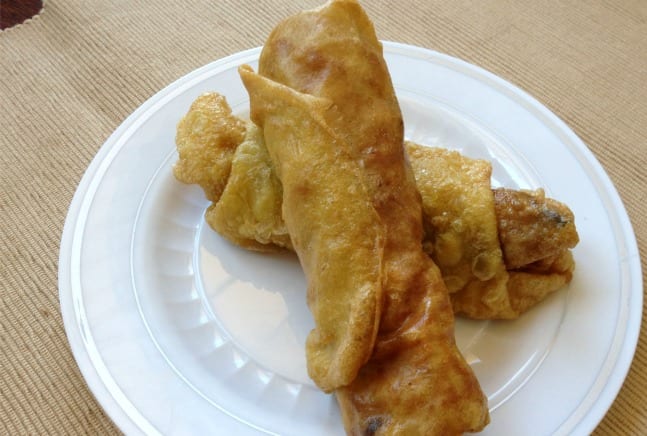
You are a GUI agent. You are given a task and a screenshot of the screen. Output one action in this format:
    pyautogui.click(x=<x>, y=<y>)
    Task: Click on the wood surface
    The image size is (647, 436).
    Given the screenshot: What is the action you would take?
    pyautogui.click(x=17, y=6)